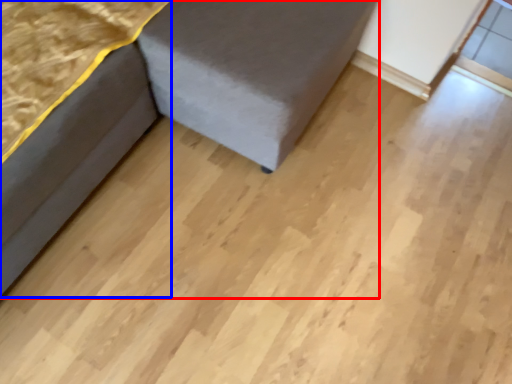
Question: Which point is closer to the camera, furniture (highlighted by a red box) or furniture (highlighted by a blue box)?

Choices:
 (A) furniture
 (B) furniture

Answer: (A)